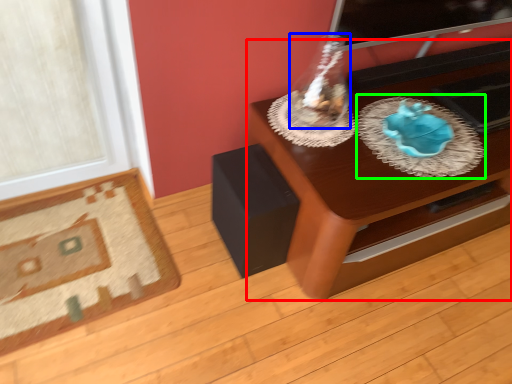
Question: Which object is positioned farthest from table (highlighted by a red box)? Select from glass vase (highlighted by a blue box) and glass plate (highlighted by a green box).

Choices:
 (A) glass vase
 (B) glass plate

Answer: (A)